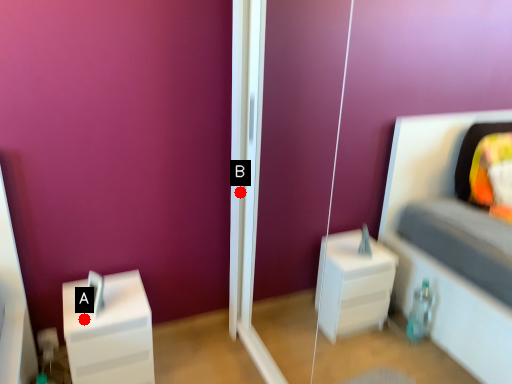
Question: Two points are circled on the image, labeled by A and B beside each circle. Which point is farther from the camera taking this photo?

Choices:
 (A) A is further
 (B) B is further

Answer: (B)